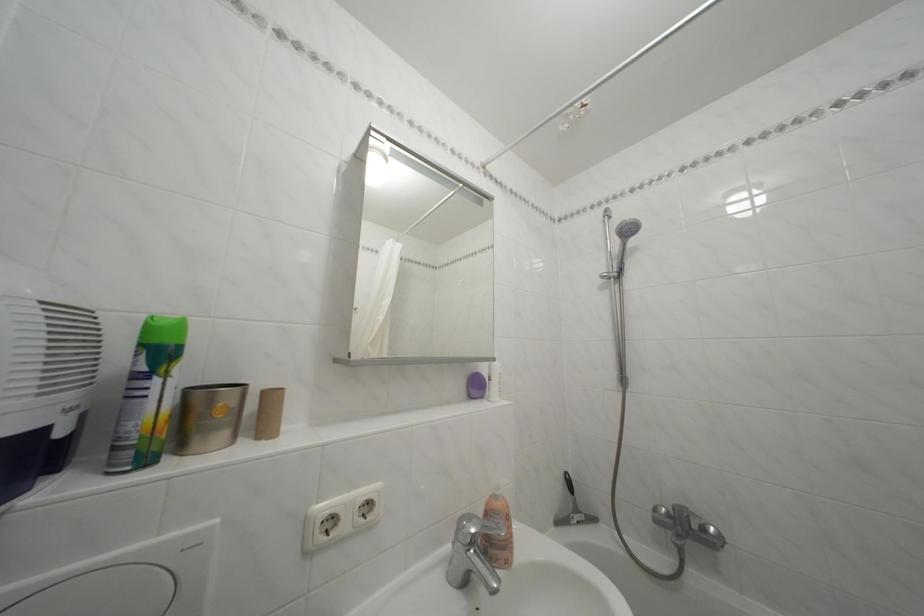
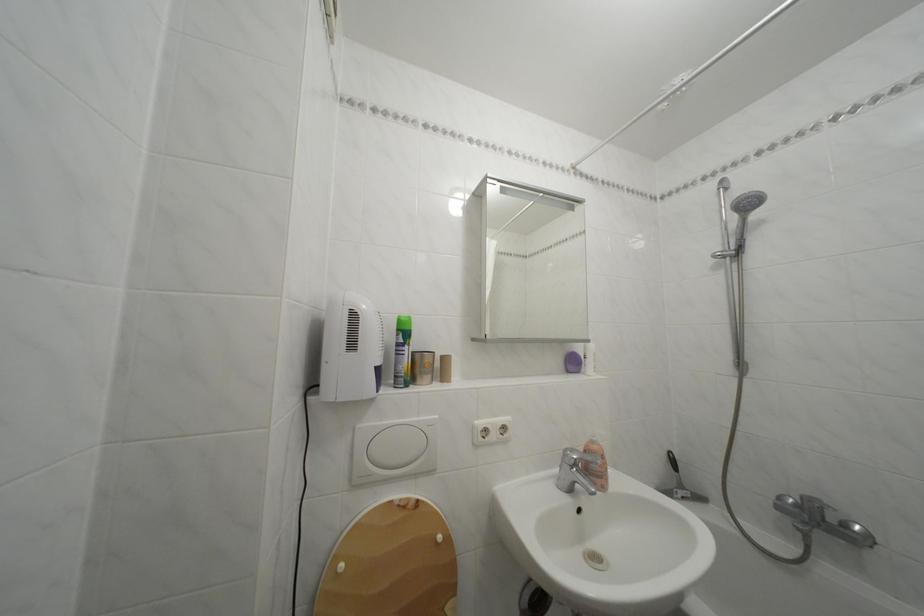
Find the pixel in the second image that matches the point at 677,522 in the first image.

(806, 512)